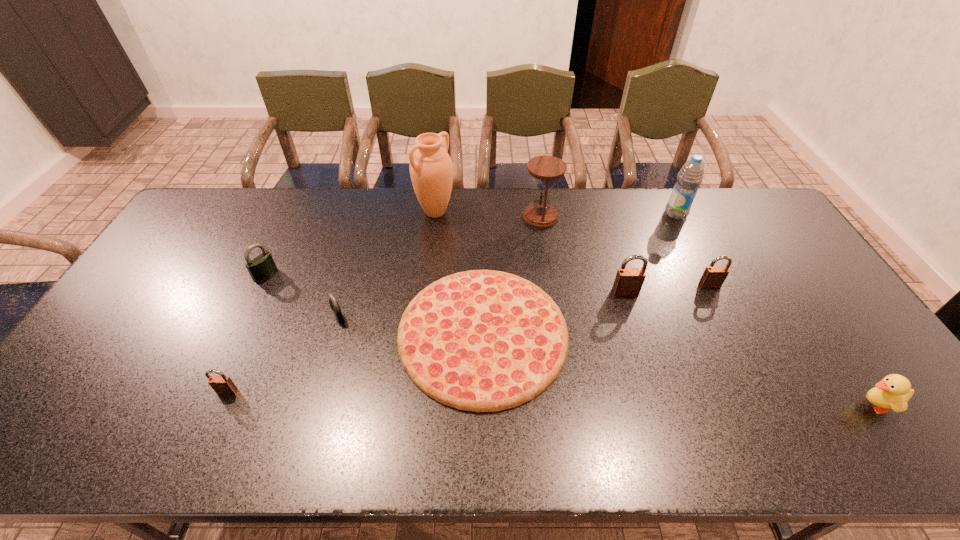
Where is `water bottle at the far edge`? The height and width of the screenshot is (540, 960). water bottle at the far edge is located at coordinates (690, 176).

Locate an element on the screen. This screenshot has width=960, height=540. hourglass that is at the far edge is located at coordinates (546, 169).

The width and height of the screenshot is (960, 540). What are the coordinates of `object that is at the right edge` in the screenshot? It's located at (893, 392).

At what (x,y) coordinates should I click in order to perform the action: click on blank area at the far edge. Please return your answer as a coordinate pair (x, y). Looking at the image, I should click on (597, 198).

The image size is (960, 540). In the image, there is a desktop. In order to click on free region at the near edge in this screenshot , I will do `click(540, 428)`.

Where is `vacant space at the left edge`? The width and height of the screenshot is (960, 540). vacant space at the left edge is located at coordinates (141, 298).

In order to click on free space at the right edge of the desktop in this screenshot , I will do `click(825, 326)`.

The height and width of the screenshot is (540, 960). In order to click on free space at the far right corner of the desktop in this screenshot , I will do `click(749, 230)`.

Locate an element on the screen. Image resolution: width=960 pixels, height=540 pixels. free point at the near right corner is located at coordinates (918, 445).

This screenshot has width=960, height=540. In order to click on vacant area that lies between the smallest brown padlock and the hourglass in this screenshot , I will do `click(384, 303)`.